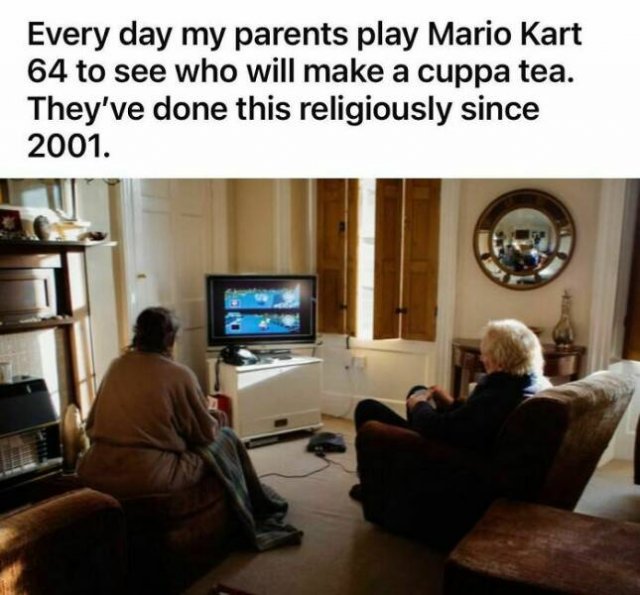
This screenshot has height=595, width=640. Identify the location of the left armrest. coord(388,438).